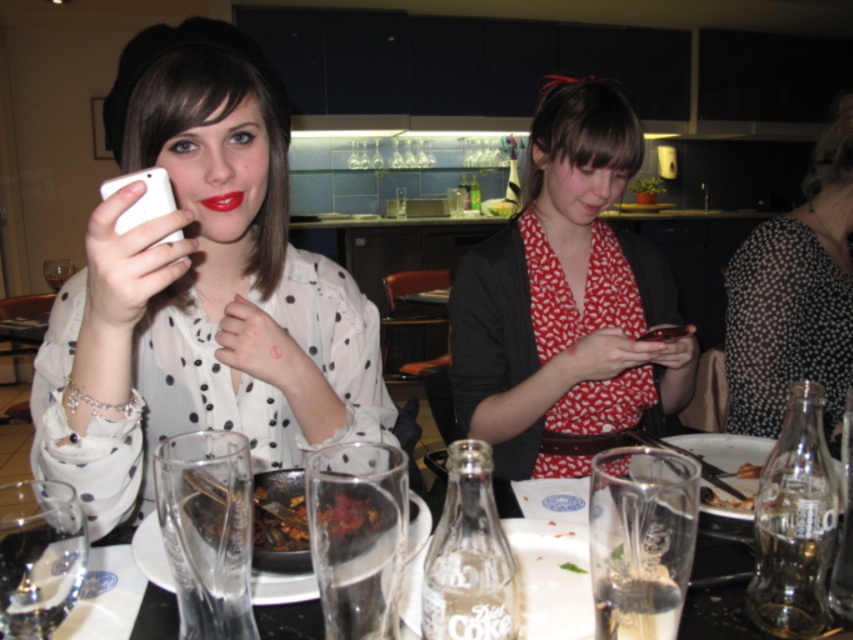
Question: Is black dotted dress at right to the right of matte red lipstick at center from the viewer's perspective?

Choices:
 (A) no
 (B) yes

Answer: (B)

Question: Which point is farther from the camera taking this photo?

Choices:
 (A) (299, 528)
 (B) (595, 192)

Answer: (B)

Question: Is matte red blouse at center closer to the viewer compared to clear glassware at lower center?

Choices:
 (A) yes
 (B) no

Answer: (B)

Question: Which object is farther from the camera taking this photo?

Choices:
 (A) matte white phone at upper left
 (B) clear glassware at lower center
 (C) matte red blouse at center

Answer: (C)

Question: Which is nearer to the dark brown glossy food at center?

Choices:
 (A) clear glassware at lower center
 (B) black dotted dress at right

Answer: (A)

Question: Is matte white phone at upper left positioned at the back of matte red lipstick at center?

Choices:
 (A) yes
 (B) no

Answer: (B)